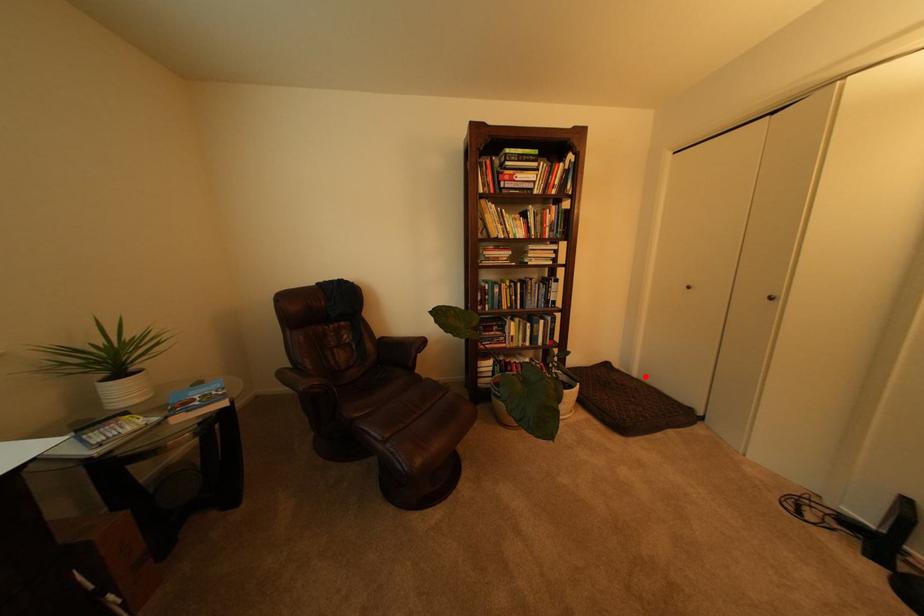
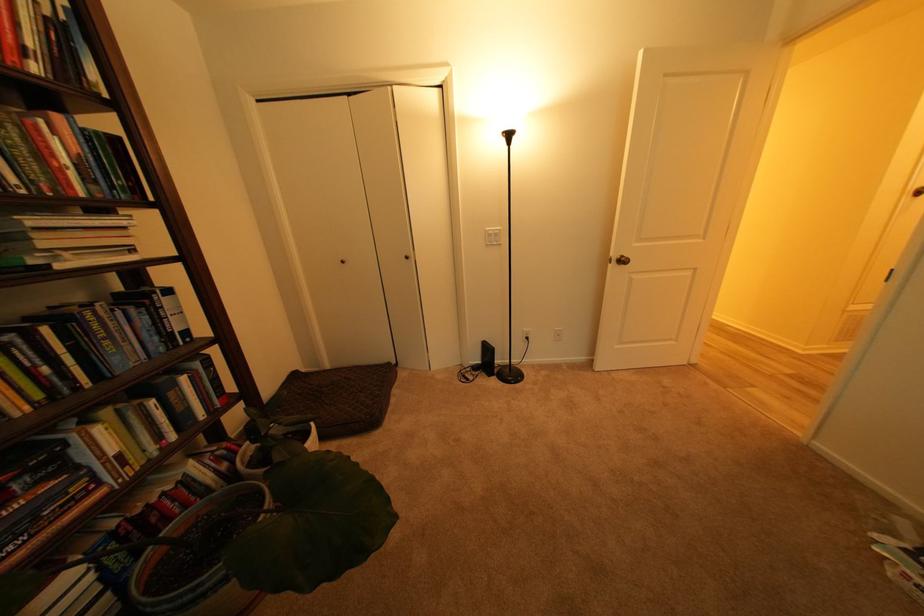
In the second image, find the point that corresponds to the highlighted location in the first image.

(338, 368)